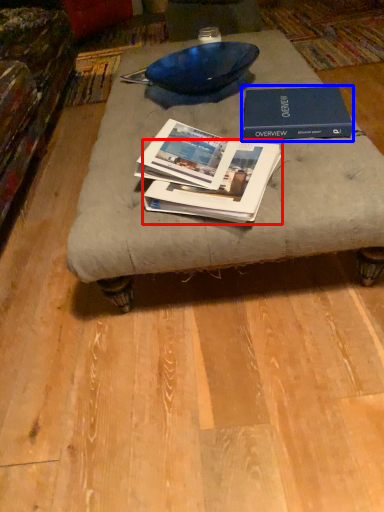
Question: Which of the following is the farthest to the observer, book (highlighted by a red box) or book (highlighted by a blue box)?

Choices:
 (A) book
 (B) book

Answer: (B)